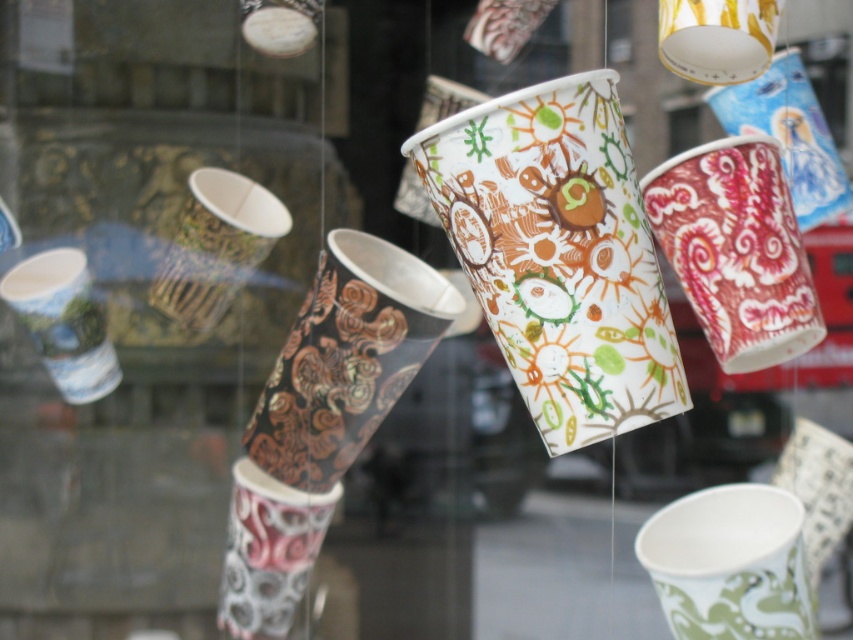
Question: Does multicolored paper cup at center appear over brown paisley-patterned cup at right?

Choices:
 (A) no
 (B) yes

Answer: (A)

Question: Which point is closer to the camera?

Choices:
 (A) multicolored paper cup at center
 (B) black metallic cup at center

Answer: (A)

Question: Is multicolored paper cup at center bigger than matte paper cup at left?

Choices:
 (A) no
 (B) yes

Answer: (B)

Question: Among these points, which one is nearest to the camera?

Choices:
 (A) [x=337, y=317]
 (B) [x=724, y=515]
 (C) [x=93, y=312]

Answer: (A)

Question: Is black metallic cup at center bigger than matte paper cup at left?

Choices:
 (A) yes
 (B) no

Answer: (A)

Question: Among these objects, which one is farthest from the camera?

Choices:
 (A) multicolored paper cup at center
 (B) matte brown paper cup at center
 (C) black metallic cup at center
 (D) white paper cup at center

Answer: (B)